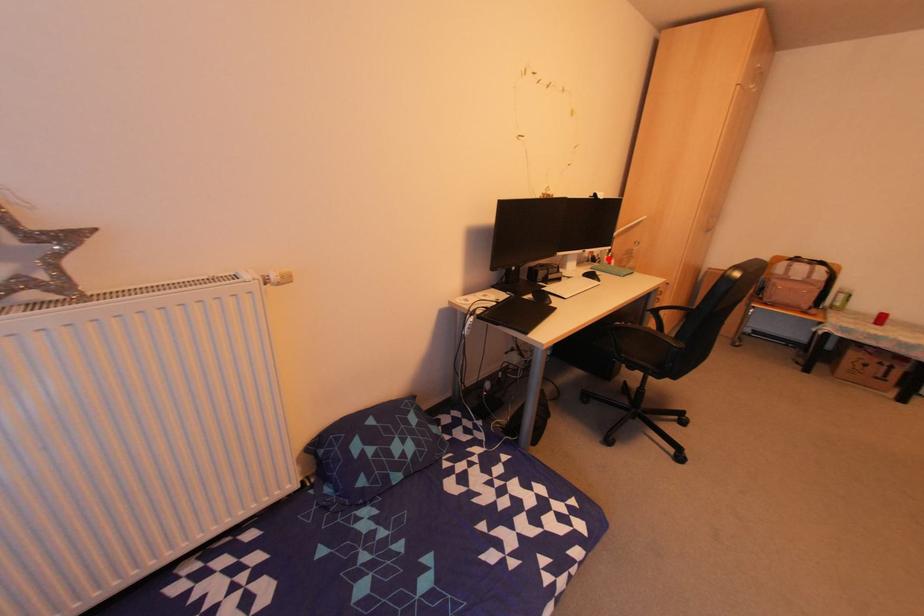
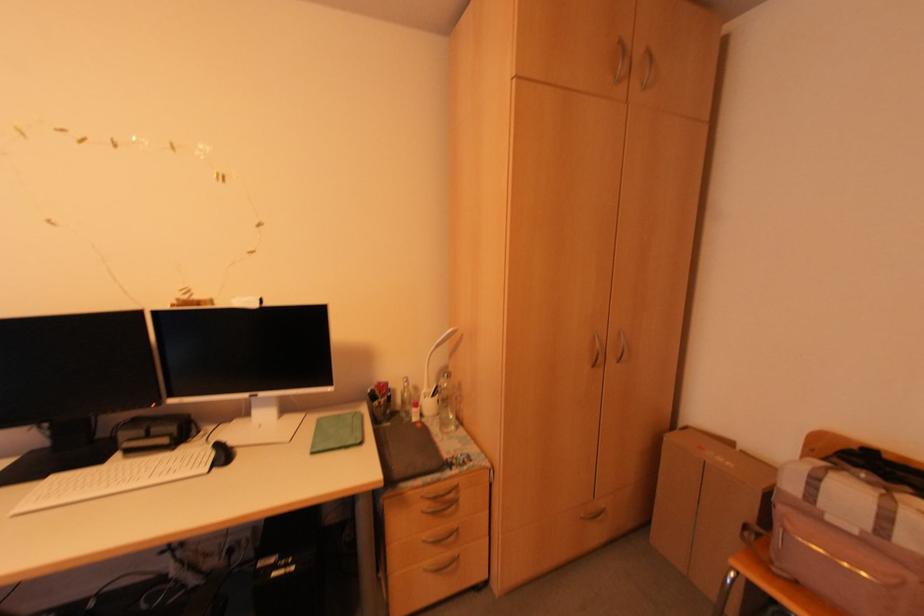
Question: I am providing you with two images of the same scene from different viewpoints. Given a red point in image1, look at the same physical point in image2. Is it:

Choices:
 (A) Closer to the viewpoint
 (B) Farther from the viewpoint

Answer: (B)